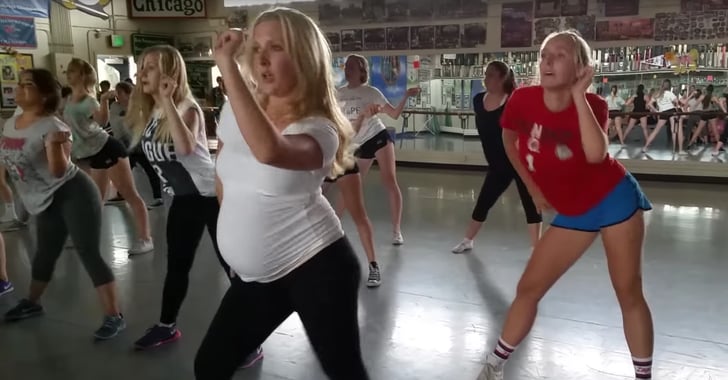
Where is `mirror`? The width and height of the screenshot is (728, 380). mirror is located at coordinates (440, 87), (683, 99).